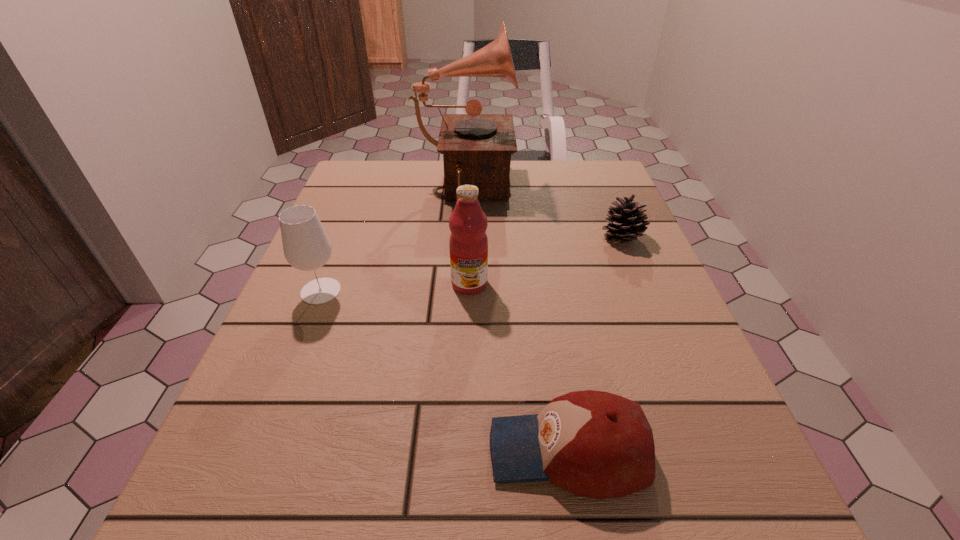
Find the location of a particular element. The image size is (960, 540). free space at the left edge of the desktop is located at coordinates (259, 355).

Where is `vacant space at the right edge of the desktop`? vacant space at the right edge of the desktop is located at coordinates (613, 355).

Find the location of a particular element. The height and width of the screenshot is (540, 960). blank space at the far left corner of the desktop is located at coordinates (356, 165).

Find the location of a particular element. The image size is (960, 540). free space at the near left corner of the desktop is located at coordinates (283, 534).

Locate an element on the screen. This screenshot has height=540, width=960. blank space at the far right corner is located at coordinates (583, 179).

Locate an element on the screen. This screenshot has height=540, width=960. vacant space at the near right corner of the desktop is located at coordinates (644, 497).

Where is `free space between the baseball cap and the rightmost object`? The height and width of the screenshot is (540, 960). free space between the baseball cap and the rightmost object is located at coordinates (595, 345).

The height and width of the screenshot is (540, 960). I want to click on blank region between the third tallest object and the nearest object, so click(x=444, y=371).

You are a GUI agent. You are given a task and a screenshot of the screen. Output one action in this format:
    pyautogui.click(x=<x>, y=<y>)
    Task: Click on the blank region between the leftmost object and the tallest object
    This screenshot has height=540, width=960.
    Given the screenshot: What is the action you would take?
    pyautogui.click(x=393, y=241)

Where is `vacant space in between the rightmost object and the nearest object`? This screenshot has width=960, height=540. vacant space in between the rightmost object and the nearest object is located at coordinates (595, 345).